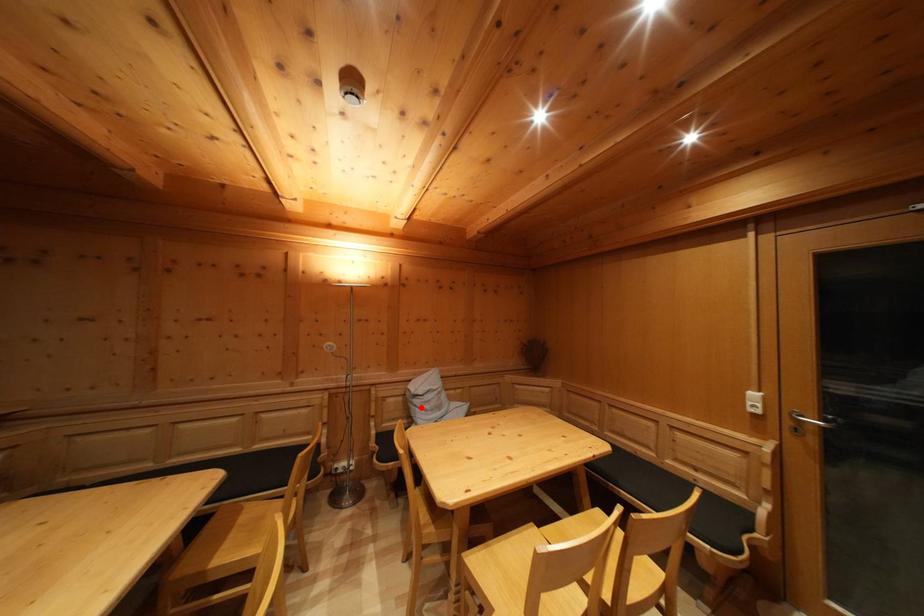
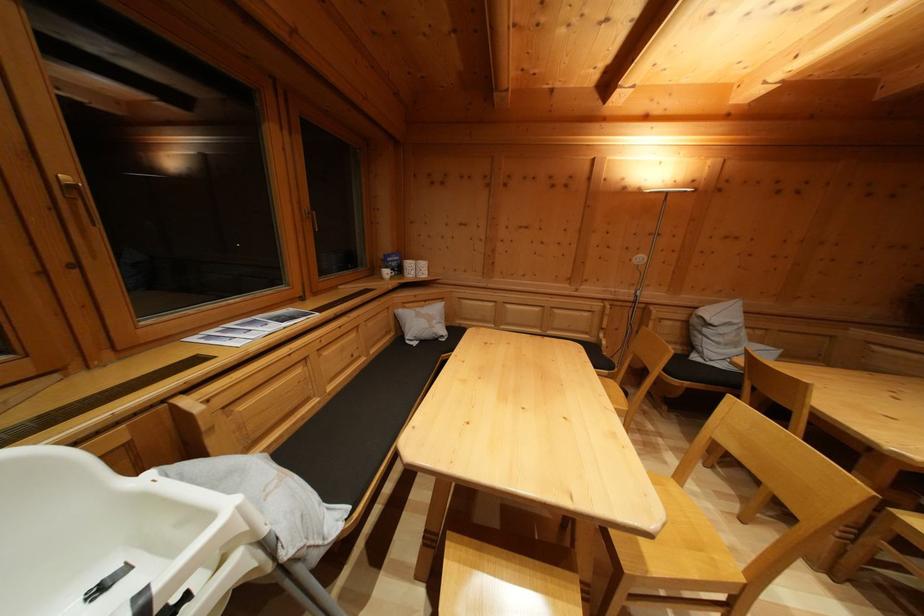
Question: A red point is marked in image1. In image2, is the corresponding 3D point closer to the camera or farther? Reply with the corresponding letter.

Choices:
 (A) The corresponding 3D point is closer.
 (B) The corresponding 3D point is farther.

Answer: (A)